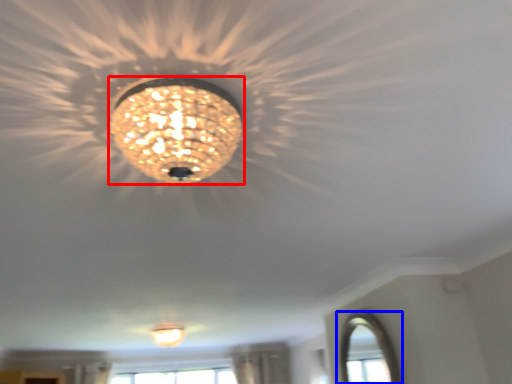
Question: Which of the following is the farthest to the observer, lamp (highlighted by a red box) or window (highlighted by a blue box)?

Choices:
 (A) lamp
 (B) window

Answer: (B)